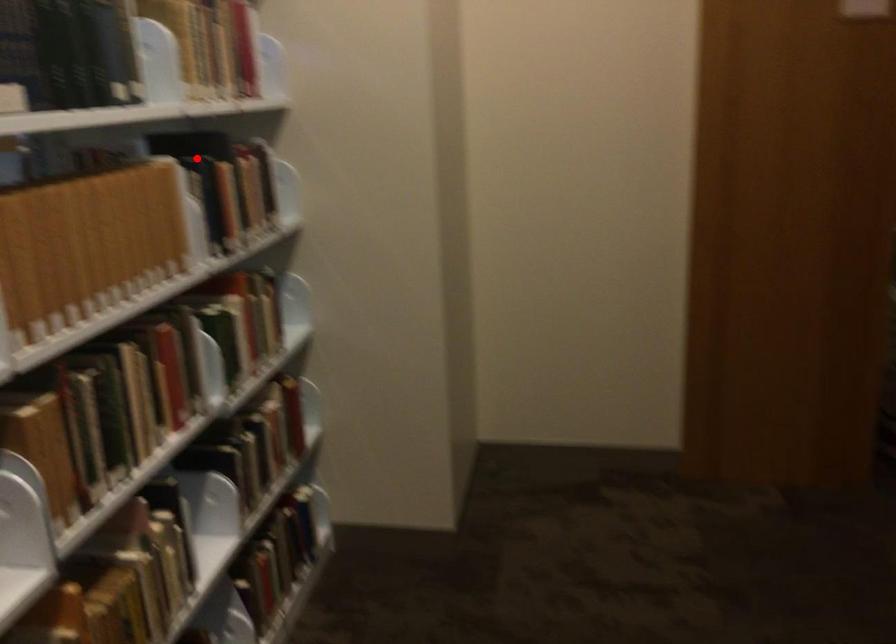
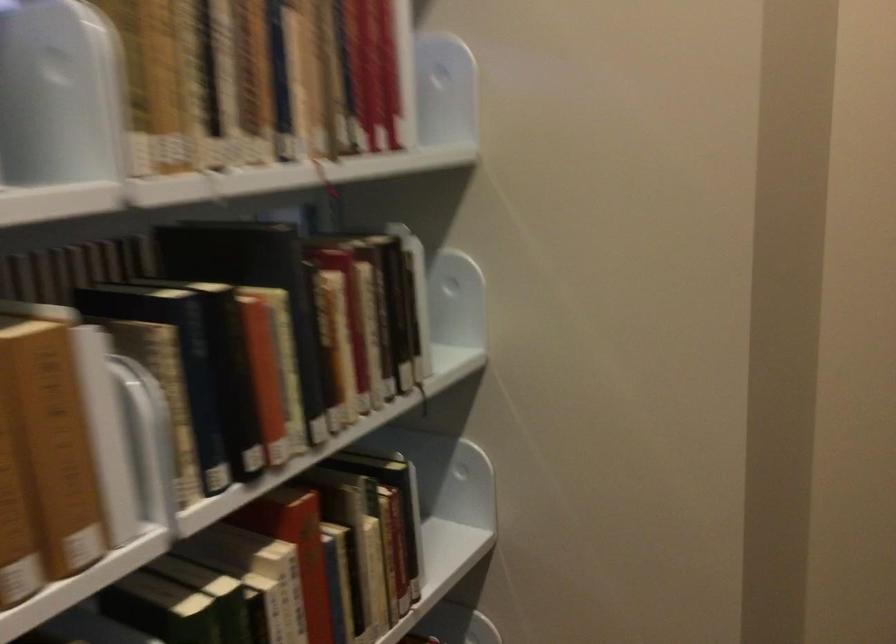
Question: I am providing you with two images of the same scene from different viewpoints. Given a red point in image1, look at the same physical point in image2. Is it:

Choices:
 (A) Closer to the viewpoint
 (B) Farther from the viewpoint

Answer: (A)